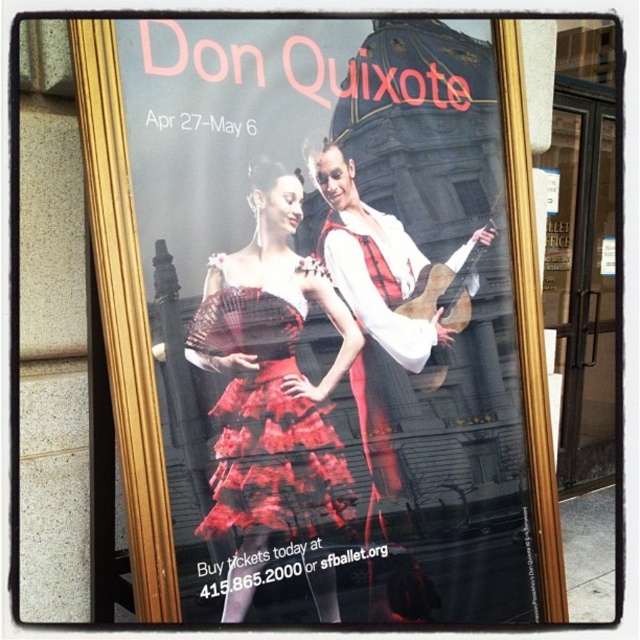
Question: Which of the following is the farthest from the observer?

Choices:
 (A) red lace dress at center
 (B) matte black violin at center

Answer: (A)

Question: Is matte black violin at center above red lace dress at center?

Choices:
 (A) yes
 (B) no

Answer: (A)

Question: Which point appears closest to the camera in this image?

Choices:
 (A) (147, 195)
 (B) (262, 438)

Answer: (A)

Question: Where is matte black violin at center located in relation to red lace dress at center in the image?

Choices:
 (A) below
 (B) above

Answer: (B)

Question: Is matte black violin at center behind red lace dress at center?

Choices:
 (A) no
 (B) yes

Answer: (A)